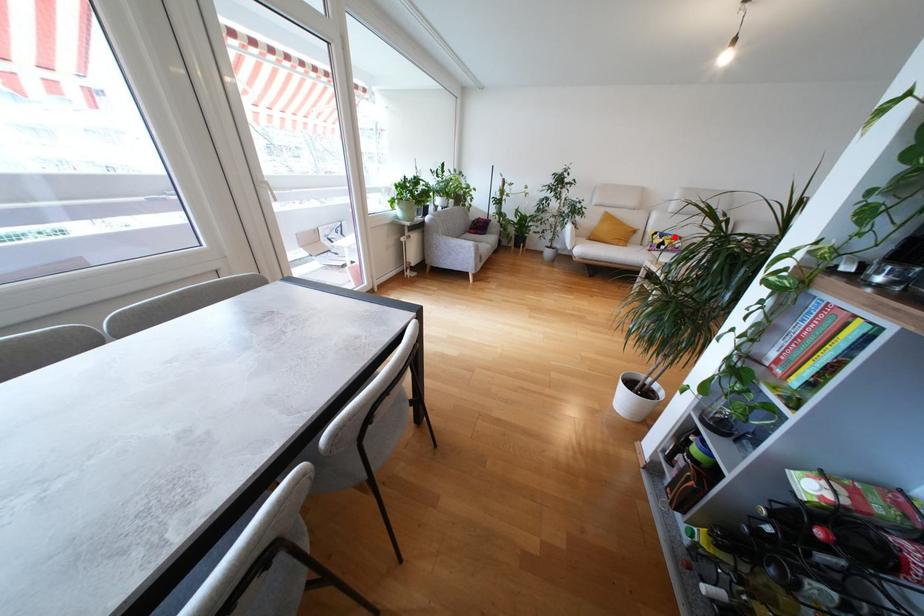
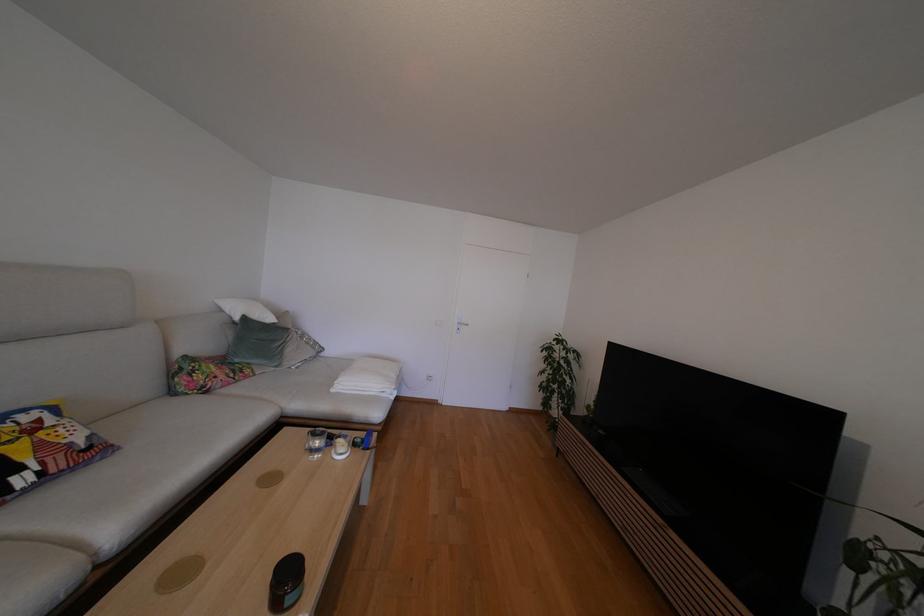
In the second image, find the point that corresponds to the highlighted location in the first image.

(6, 419)